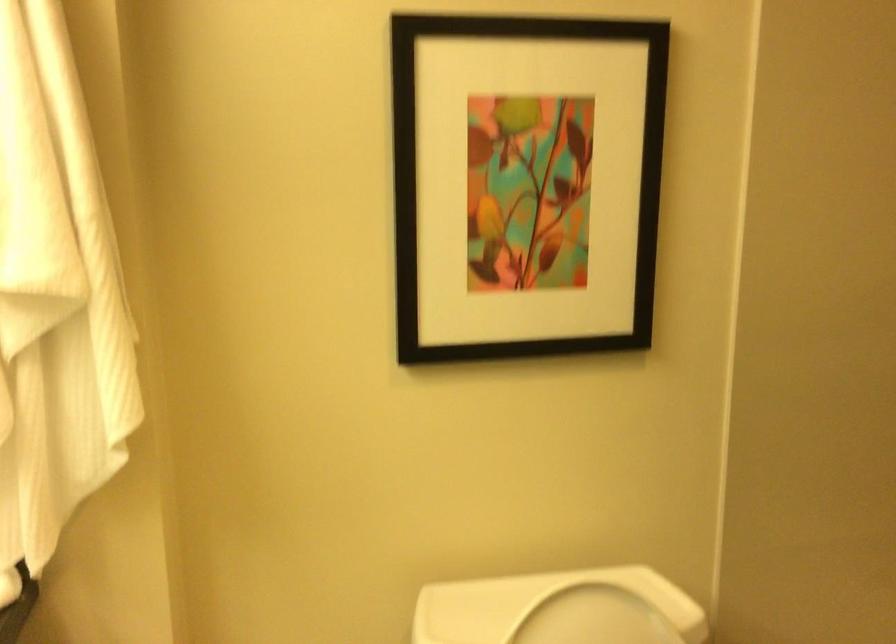
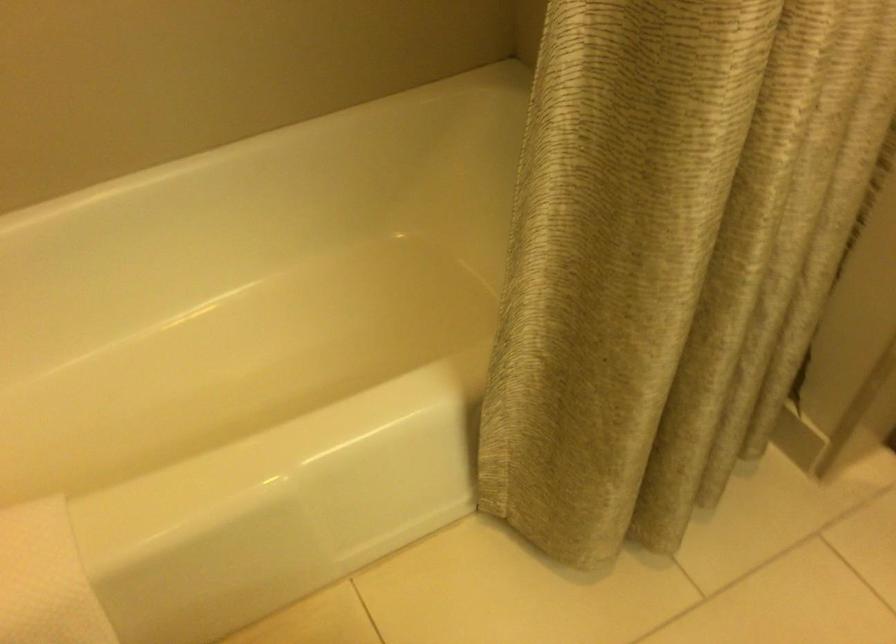
The images are taken continuously from a first-person perspective. In which direction is your viewpoint rotating?

The camera's rotation is toward right-down.